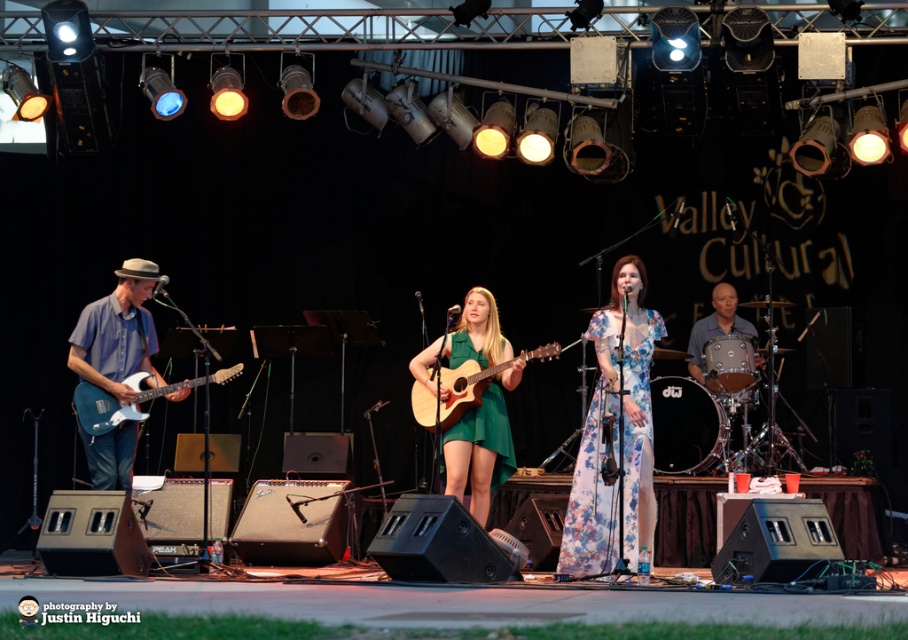
Question: Among these objects, which one is nearest to the camera?

Choices:
 (A) natural wood acoustic guitar at center
 (B) green matte dress at center
 (C) blue matte electric guitar at left
 (D) floral fabric dress at center

Answer: (D)

Question: Which is nearer to the green matte dress at center?

Choices:
 (A) blue matte electric guitar at left
 (B) metallic blue electric guitar at left
 (C) floral fabric dress at center

Answer: (C)

Question: Observing the image, what is the correct spatial positioning of blue matte electric guitar at left in reference to natural wood acoustic guitar at center?

Choices:
 (A) below
 (B) above

Answer: (B)

Question: In this image, where is green matte dress at center located relative to natural wood acoustic guitar at center?

Choices:
 (A) left
 (B) right

Answer: (A)

Question: Is green matte dress at center positioned behind metallic blue electric guitar at left?

Choices:
 (A) no
 (B) yes

Answer: (B)

Question: Which point appears closest to the camera in this image?

Choices:
 (A) (140, 372)
 (B) (454, 416)
 (C) (508, 442)
 (D) (638, 323)

Answer: (D)